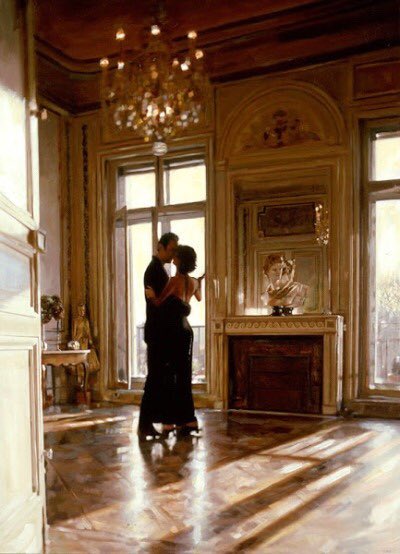
Identify the location of statue. (77, 330).